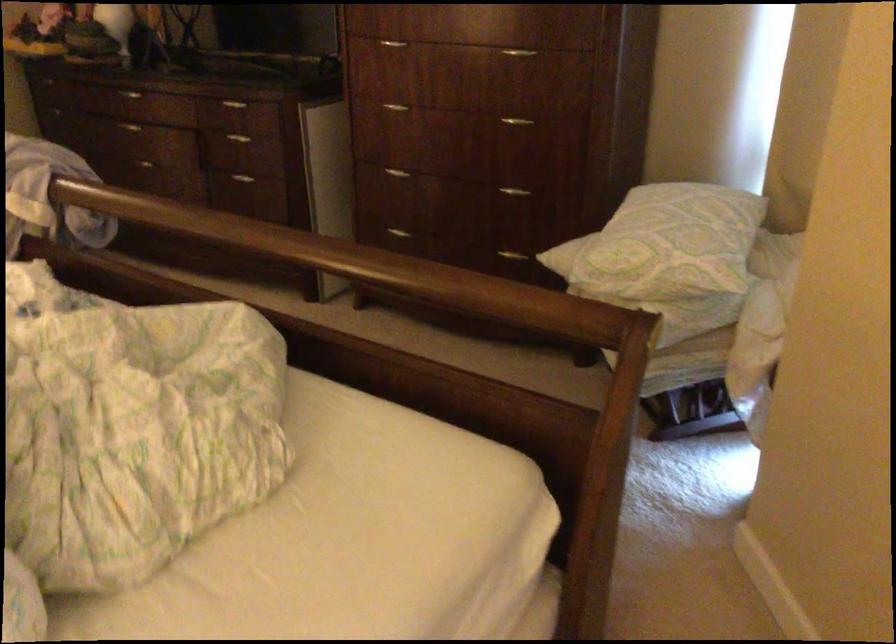
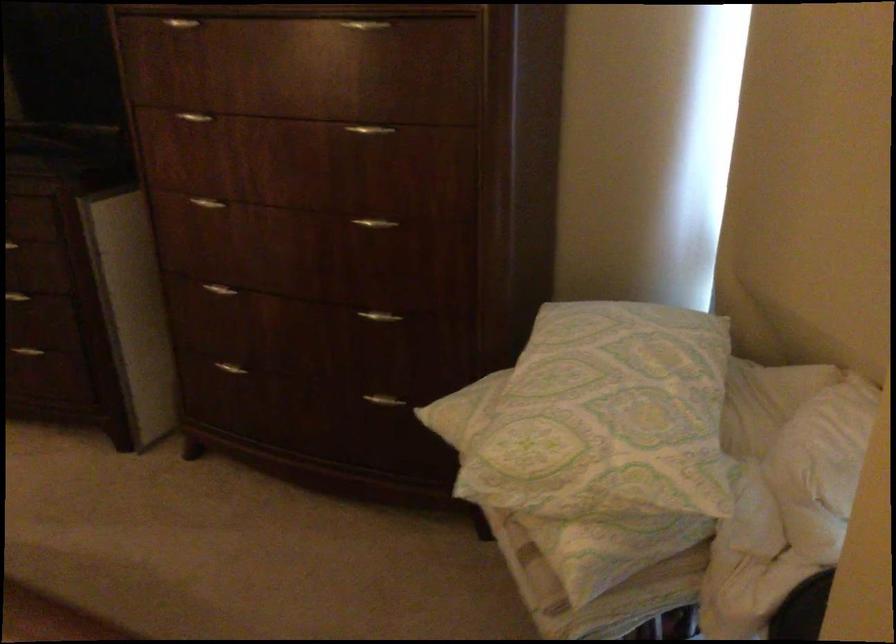
The point at [675,234] is marked in the first image. Where is the corresponding point in the second image?

(607, 415)